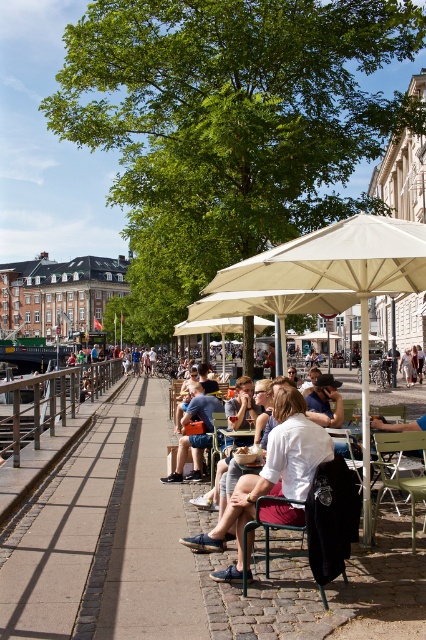
Question: Which object is closer to the camera taking this photo?

Choices:
 (A) white cotton shirt at center
 (B) denim shorts at center

Answer: (A)

Question: Does white cotton shirt at center have a larger size compared to denim shorts at center?

Choices:
 (A) yes
 (B) no

Answer: (A)

Question: Can you confirm if white cotton shirt at center is positioned below denim shorts at center?

Choices:
 (A) no
 (B) yes

Answer: (A)

Question: From the image, what is the correct spatial relationship of white cotton shirt at center in relation to denim shorts at center?

Choices:
 (A) below
 (B) above

Answer: (B)

Question: Which of the following is the closest to the observer?

Choices:
 (A) (189, 408)
 (B) (242, 500)

Answer: (B)